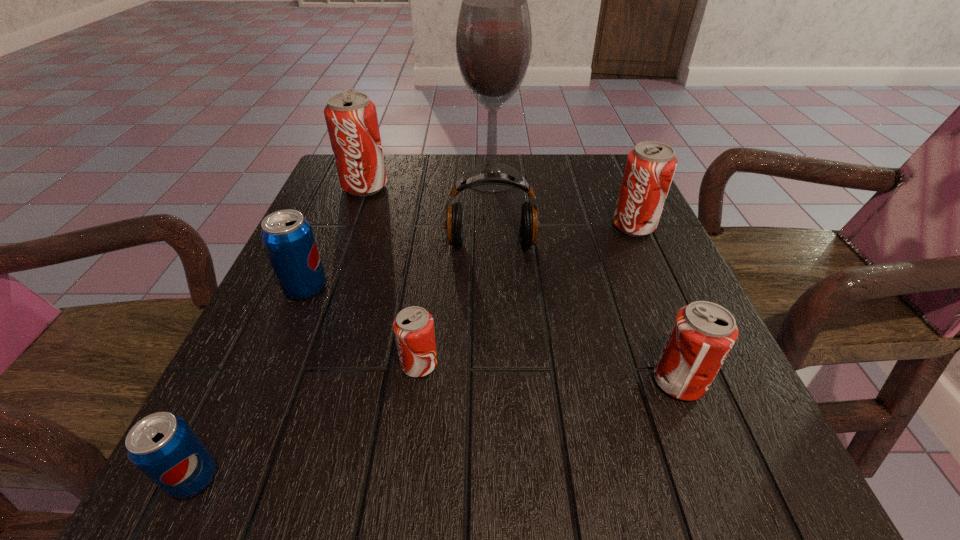
Find the location of a particular element. The width and height of the screenshot is (960, 540). alcohol is located at coordinates [494, 38].

You are a GUI agent. You are given a task and a screenshot of the screen. Output one action in this format:
    pyautogui.click(x=<x>, y=<y>)
    Task: Click on the tallest object
    The image size is (960, 540).
    Given the screenshot: What is the action you would take?
    click(494, 38)

Locate an element on the screen. The width and height of the screenshot is (960, 540). the seventh shortest object is located at coordinates (351, 118).

This screenshot has width=960, height=540. Identify the location of the leftmost pink soda can. (351, 118).

The height and width of the screenshot is (540, 960). I want to click on the fifth shortest pop soda, so click(650, 167).

What are the coordinates of `the third nearest pink soda can` in the screenshot? It's located at (650, 167).

The height and width of the screenshot is (540, 960). I want to click on headset, so click(529, 225).

I want to click on the fourth nearest pop soda, so click(287, 236).

Identify the location of the fifth farthest object. This screenshot has width=960, height=540. (287, 236).

Identify the location of the third biggest pink soda can. Image resolution: width=960 pixels, height=540 pixels. (703, 333).